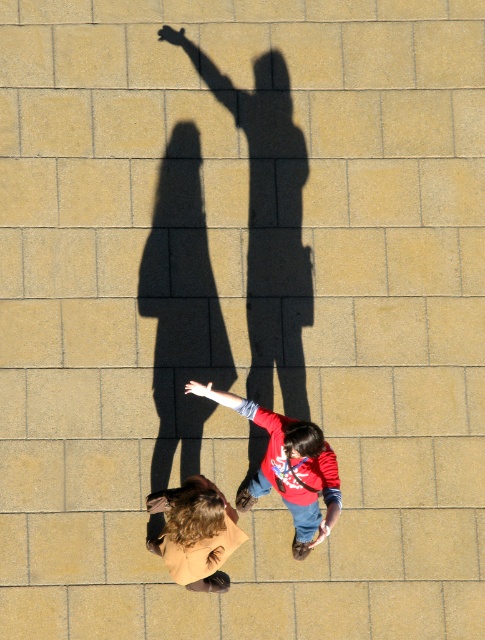
You are standing at the point with coordinates point [192,492] and want to walk towards the point [317,538]. Will you be moving forward or backward relative to your current position?

Since point [192,492] is in front of point [317,538], moving towards it would require you to walk backward relative to your current position.

You are a photographer setting up a camera to capture the interaction between the two people in the scene. You notice the matte black arm at upper center and the smooth black hand at upper center. To ensure both are in focus, what is the minimum distance your camera lens should be set to focus on?

The matte black arm at upper center is 5.22 inches away from the smooth black hand at upper center. Therefore, the minimum focus distance should be set to at least 5.22 inches to ensure both are in focus.